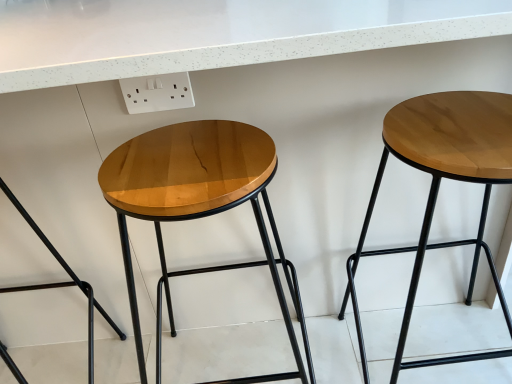
What do you see at coordinates (63, 282) in the screenshot? The image size is (512, 384). I see `wooden/marbled stool at left, positioned as the 3th stool in right-to-left order` at bounding box center [63, 282].

In order to click on white plastic outlet at upper center in this screenshot , I will do `click(157, 93)`.

Does white plastic outlet at upper center have a lesser height compared to wooden stool at right, arranged as the first stool when viewed from the right?

Yes.

Looking at their sizes, would you say white plastic outlet at upper center is wider or thinner than wooden stool at right, arranged as the first stool when viewed from the right?

Considering their sizes, white plastic outlet at upper center looks slimmer than wooden stool at right, arranged as the first stool when viewed from the right.

In the image, is white plastic outlet at upper center positioned in front of or behind wooden stool at right, arranged as the first stool when viewed from the right?

Clearly, white plastic outlet at upper center is behind wooden stool at right, arranged as the first stool when viewed from the right.

Consider the image. Is wooden stool at center, which is the second stool from left to right, taller or shorter than white plastic outlet at upper center?

Considering their sizes, wooden stool at center, which is the second stool from left to right, has more height than white plastic outlet at upper center.

This screenshot has height=384, width=512. I want to click on electric outlet on the left of wooden stool at center, which is the second stool from left to right, so [x=157, y=93].

Is wooden stool at center, which is the second stool from right to left, to the left of white plastic outlet at upper center from the viewer's perspective?

No.

From a real-world perspective, is wooden stool at center, which is the second stool from left to right, above or below white plastic outlet at upper center?

In terms of real-world spatial position, wooden stool at center, which is the second stool from left to right, is below white plastic outlet at upper center.

Is wooden stool at center, which is the second stool from left to right, oriented towards wooden/marbled stool at left, positioned as the 3th stool in right-to-left order?

No, wooden stool at center, which is the second stool from left to right, is not turned towards wooden/marbled stool at left, positioned as the 3th stool in right-to-left order.

Is wooden stool at center, which is the second stool from right to left, thinner than wooden/marbled stool at left, positioned as the 3th stool in right-to-left order?

No, wooden stool at center, which is the second stool from right to left, is not thinner than wooden/marbled stool at left, positioned as the 3th stool in right-to-left order.

Who is shorter, wooden stool at center, which is the second stool from left to right, or wooden/marbled stool at left, which appears as the 1th stool when viewed from the left?

Standing shorter between the two is wooden stool at center, which is the second stool from left to right.

Which is more distant, [294,269] or [24,379]?

The point [24,379] is farther from the camera.

From the picture: Measure the distance between white plastic outlet at upper center and wooden stool at center, which is the second stool from right to left.

They are 13.22 inches apart.

From the image's perspective, relative to wooden stool at center, which is the second stool from left to right, is white plastic outlet at upper center above or below?

From the image's perspective, white plastic outlet at upper center appears above wooden stool at center, which is the second stool from left to right.

Locate an element on the screen. Image resolution: width=512 pixels, height=384 pixels. electric outlet above the wooden stool at center, which is the second stool from left to right (from a real-world perspective) is located at coordinates (157, 93).

In the scene shown: From a real-world perspective, which is physically below, white plastic outlet at upper center or wooden stool at center, which is the second stool from left to right?

wooden stool at center, which is the second stool from left to right, from a real-world perspective.

Considering the relative positions of wooden/marbled stool at left, positioned as the 3th stool in right-to-left order, and wooden stool at right, the third stool in the left-to-right sequence, in the image provided, is wooden/marbled stool at left, positioned as the 3th stool in right-to-left order, to the left or to the right of wooden stool at right, the third stool in the left-to-right sequence,?

wooden/marbled stool at left, positioned as the 3th stool in right-to-left order, is positioned on wooden stool at right, the third stool in the left-to-right sequence,'s left side.

Could you tell me if wooden/marbled stool at left, which appears as the 1th stool when viewed from the left, is turned towards wooden stool at right, the third stool in the left-to-right sequence?

No, wooden/marbled stool at left, which appears as the 1th stool when viewed from the left, is not facing towards wooden stool at right, the third stool in the left-to-right sequence.

Is point (17, 203) farther from camera compared to point (480, 172)?

That is True.

From the image's perspective, is wooden stool at right, arranged as the first stool when viewed from the right, above or below wooden/marbled stool at left, positioned as the 3th stool in right-to-left order?

Clearly, from the image's perspective, wooden stool at right, arranged as the first stool when viewed from the right, is above wooden/marbled stool at left, positioned as the 3th stool in right-to-left order.

Considering the sizes of objects wooden stool at right, arranged as the first stool when viewed from the right, and wooden/marbled stool at left, positioned as the 3th stool in right-to-left order, in the image provided, who is shorter, wooden stool at right, arranged as the first stool when viewed from the right, or wooden/marbled stool at left, positioned as the 3th stool in right-to-left order,?

wooden stool at right, arranged as the first stool when viewed from the right.

Find the location of a particular element. stool that is the 2nd object directly below the wooden/marbled stool at left, which appears as the 1th stool when viewed from the left (from a real-world perspective) is located at coordinates (439, 185).

From the image's perspective, which one is positioned lower, wooden/marbled stool at left, positioned as the 3th stool in right-to-left order, or white plastic outlet at upper center?

wooden/marbled stool at left, positioned as the 3th stool in right-to-left order.

Considering the sizes of wooden/marbled stool at left, positioned as the 3th stool in right-to-left order, and white plastic outlet at upper center in the image, is wooden/marbled stool at left, positioned as the 3th stool in right-to-left order, bigger or smaller than white plastic outlet at upper center?

In the image, wooden/marbled stool at left, positioned as the 3th stool in right-to-left order, appears to be larger than white plastic outlet at upper center.

Is the position of wooden/marbled stool at left, which appears as the 1th stool when viewed from the left, less distant than that of white plastic outlet at upper center?

Yes, it is in front of white plastic outlet at upper center.

From a real-world perspective, which object stands above the other?

white plastic outlet at upper center.

This screenshot has width=512, height=384. There is a wooden stool at right, arranged as the first stool when viewed from the right. Identify the location of electric outlet above it (from a real-world perspective). (157, 93).

You are a GUI agent. You are given a task and a screenshot of the screen. Output one action in this format:
    pyautogui.click(x=<x>, y=<y>)
    Task: Click on the 2nd stool in front of the white plastic outlet at upper center, starting your count from the anchor
    This screenshot has height=384, width=512.
    Given the screenshot: What is the action you would take?
    pyautogui.click(x=200, y=202)

Looking at this image, considering their positions, is wooden stool at right, arranged as the first stool when viewed from the right, positioned closer to wooden/marbled stool at left, which appears as the 1th stool when viewed from the left, than wooden stool at center, which is the second stool from right to left?

wooden stool at center, which is the second stool from right to left.

From the picture: Which object lies further to the anchor point wooden stool at right, the third stool in the left-to-right sequence, white plastic outlet at upper center or wooden/marbled stool at left, which appears as the 1th stool when viewed from the left?

Among the two, wooden/marbled stool at left, which appears as the 1th stool when viewed from the left, is located further to wooden stool at right, the third stool in the left-to-right sequence.

When comparing their distances from white plastic outlet at upper center, does wooden stool at center, which is the second stool from left to right, or wooden stool at right, arranged as the first stool when viewed from the right, seem closer?

Based on the image, wooden stool at center, which is the second stool from left to right, appears to be nearer to white plastic outlet at upper center.

When comparing their distances from wooden/marbled stool at left, positioned as the 3th stool in right-to-left order, does wooden stool at center, which is the second stool from right to left, or wooden stool at right, the third stool in the left-to-right sequence, seem closer?

wooden stool at center, which is the second stool from right to left, is closer to wooden/marbled stool at left, positioned as the 3th stool in right-to-left order.

Based on the photo, estimate the real-world distances between objects in this image. Which object is closer to wooden/marbled stool at left, positioned as the 3th stool in right-to-left order, wooden stool at right, the third stool in the left-to-right sequence, or white plastic outlet at upper center?

white plastic outlet at upper center is closer to wooden/marbled stool at left, positioned as the 3th stool in right-to-left order.

From the picture: When comparing their distances from wooden stool at right, the third stool in the left-to-right sequence, does wooden/marbled stool at left, positioned as the 3th stool in right-to-left order, or white plastic outlet at upper center seem further?

wooden/marbled stool at left, positioned as the 3th stool in right-to-left order, is further to wooden stool at right, the third stool in the left-to-right sequence.

Considering their positions, is wooden stool at right, the third stool in the left-to-right sequence, positioned closer to wooden stool at center, which is the second stool from right to left, than wooden/marbled stool at left, which appears as the 1th stool when viewed from the left?

Among the two, wooden stool at right, the third stool in the left-to-right sequence, is located nearer to wooden stool at center, which is the second stool from right to left.

Looking at the image, which one is located closer to white plastic outlet at upper center, wooden/marbled stool at left, which appears as the 1th stool when viewed from the left, or wooden stool at right, arranged as the first stool when viewed from the right?

wooden/marbled stool at left, which appears as the 1th stool when viewed from the left, lies closer to white plastic outlet at upper center than the other object.

Image resolution: width=512 pixels, height=384 pixels. I want to click on electric outlet between wooden/marbled stool at left, positioned as the 3th stool in right-to-left order, and wooden stool at center, which is the second stool from right to left, from left to right, so click(157, 93).

At what (x,y) coordinates should I click in order to perform the action: click on electric outlet situated between wooden/marbled stool at left, positioned as the 3th stool in right-to-left order, and wooden stool at right, arranged as the first stool when viewed from the right, from left to right. Please return your answer as a coordinate pair (x, y). Looking at the image, I should click on (157, 93).

Identify the location of stool between wooden/marbled stool at left, positioned as the 3th stool in right-to-left order, and wooden stool at right, arranged as the first stool when viewed from the right, from left to right. This screenshot has width=512, height=384. (200, 202).

Locate an element on the screen. The width and height of the screenshot is (512, 384). stool situated between white plastic outlet at upper center and wooden stool at right, the third stool in the left-to-right sequence, from left to right is located at coordinates coord(200,202).